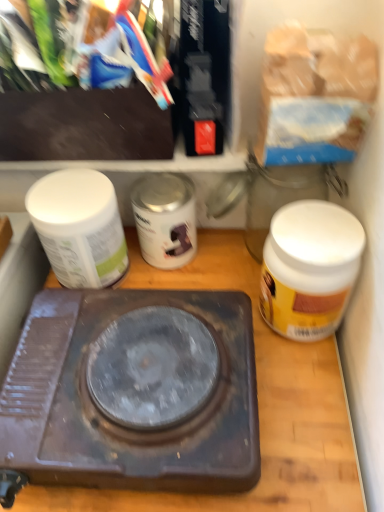
Question: Considering the relative sizes of silver metallic can at center, the second bottle when ordered from left to right, and white matte jar at left, which appears as the third bottle when viewed from the right, in the image provided, is silver metallic can at center, the second bottle when ordered from left to right, thinner than white matte jar at left, which appears as the third bottle when viewed from the right,?

Choices:
 (A) yes
 (B) no

Answer: (A)

Question: Is silver metallic can at center, the 2th bottle from the right, facing away from white matte jar at left, the first bottle when ordered from left to right?

Choices:
 (A) no
 (B) yes

Answer: (A)

Question: Can you confirm if silver metallic can at center, the second bottle when ordered from left to right, is bigger than white matte jar at left, which appears as the third bottle when viewed from the right?

Choices:
 (A) no
 (B) yes

Answer: (A)

Question: Is the position of silver metallic can at center, the 2th bottle from the right, more distant than that of white matte jar at left, which appears as the third bottle when viewed from the right?

Choices:
 (A) no
 (B) yes

Answer: (B)

Question: Is white matte jar at left, which appears as the third bottle when viewed from the right, a part of silver metallic can at center, the second bottle when ordered from left to right?

Choices:
 (A) no
 (B) yes

Answer: (A)

Question: Looking at their shapes, would you say rusty metal stove at center is wider or thinner than brown matte/wooden counter top at center?

Choices:
 (A) thin
 (B) wide

Answer: (A)

Question: From the image's perspective, is rusty metal stove at center located above or below brown matte/wooden counter top at center?

Choices:
 (A) above
 (B) below

Answer: (B)

Question: From a real-world perspective, relative to brown matte/wooden counter top at center, is rusty metal stove at center vertically above or below?

Choices:
 (A) below
 (B) above

Answer: (B)

Question: Is rusty metal stove at center to the left or to the right of brown matte/wooden counter top at center in the image?

Choices:
 (A) right
 (B) left

Answer: (B)

Question: Looking at the image, does white matte jar at right, the third bottle when ordered from left to right, seem bigger or smaller compared to silver metallic can at center, the second bottle when ordered from left to right?

Choices:
 (A) big
 (B) small

Answer: (A)

Question: Choose the correct answer: Is white matte jar at right, which is counted as the 1th bottle, starting from the right, inside silver metallic can at center, the second bottle when ordered from left to right, or outside it?

Choices:
 (A) outside
 (B) inside

Answer: (A)

Question: Looking at their shapes, would you say white matte jar at right, which is counted as the 1th bottle, starting from the right, is wider or thinner than silver metallic can at center, the 2th bottle from the right?

Choices:
 (A) thin
 (B) wide

Answer: (B)

Question: From a real-world perspective, is white matte jar at right, the third bottle when ordered from left to right, positioned above or below silver metallic can at center, the 2th bottle from the right?

Choices:
 (A) below
 (B) above

Answer: (B)

Question: Is white matte jar at left, the first bottle when ordered from left to right, in front of or behind white matte jar at right, the third bottle when ordered from left to right, in the image?

Choices:
 (A) behind
 (B) front

Answer: (A)

Question: In the image, is white matte jar at left, the first bottle when ordered from left to right, on the left side or the right side of white matte jar at right, which is counted as the 1th bottle, starting from the right?

Choices:
 (A) left
 (B) right

Answer: (A)